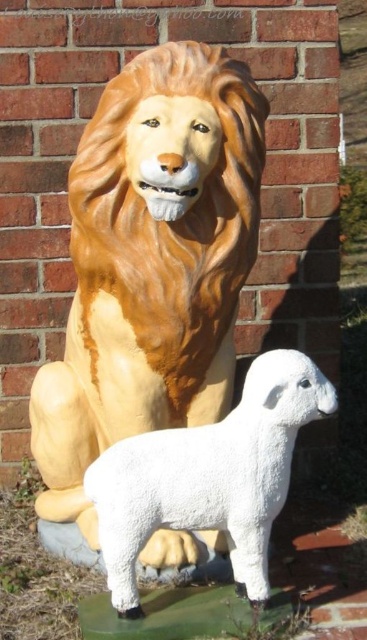
Question: Is matte golden lion at center bigger than white fluffy lamb at lower center?

Choices:
 (A) no
 (B) yes

Answer: (B)

Question: Is matte golden lion at center to the right of white fluffy lamb at lower center from the viewer's perspective?

Choices:
 (A) yes
 (B) no

Answer: (B)

Question: Which point is closer to the camera taking this photo?

Choices:
 (A) (81, 236)
 (B) (136, 595)

Answer: (B)

Question: Can you confirm if matte golden lion at center is thinner than white fluffy lamb at lower center?

Choices:
 (A) yes
 (B) no

Answer: (B)

Question: Which of the following is the farthest from the observer?

Choices:
 (A) white fluffy lamb at lower center
 (B) matte golden lion at center

Answer: (B)